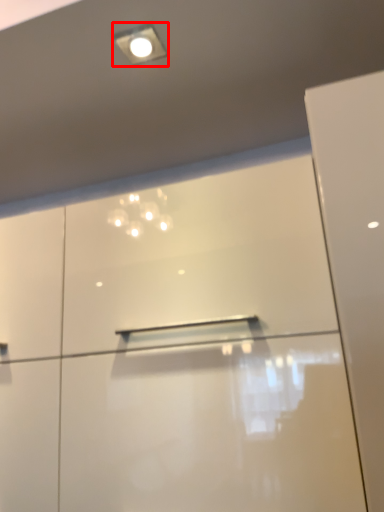
Question: Observing the image, what is the correct spatial positioning of droplight (annotated by the red box) in reference to dresser?

Choices:
 (A) right
 (B) left

Answer: (A)